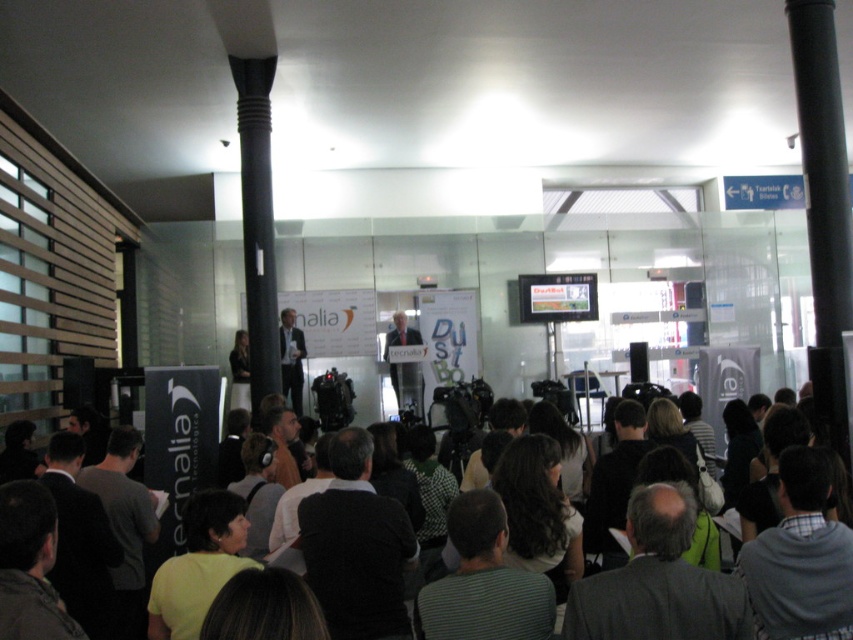
Question: Is dark gray clothing at center closer to camera compared to dark suit at center?

Choices:
 (A) yes
 (B) no

Answer: (A)

Question: Which point is closer to the camera?

Choices:
 (A) (399, 365)
 (B) (718, 588)

Answer: (B)

Question: Which object is closer to the camera taking this photo?

Choices:
 (A) dark gray clothing at center
 (B) matte black suit at center

Answer: (A)

Question: Which point is closer to the camera?

Choices:
 (A) (830, 614)
 (B) (402, 310)

Answer: (A)

Question: Is matte black suit at center closer to the viewer compared to dark suit at center?

Choices:
 (A) yes
 (B) no

Answer: (B)

Question: Can you confirm if dark gray clothing at center is smaller than matte black suit at center?

Choices:
 (A) yes
 (B) no

Answer: (B)